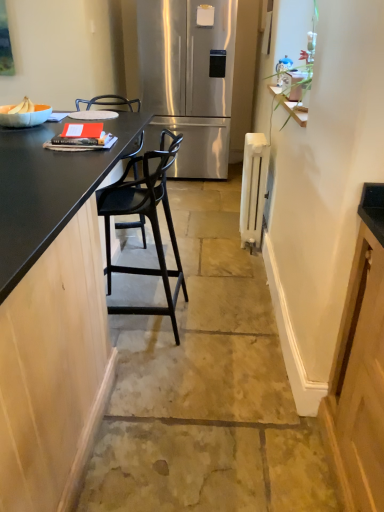
This screenshot has width=384, height=512. Describe the element at coordinates (184, 78) in the screenshot. I see `stainless steel refrigerator at center` at that location.

Locate an element on the screen. The width and height of the screenshot is (384, 512). black matte bar stool at center is located at coordinates (149, 220).

From a real-world perspective, is black matte bar stool at center positioned over stainless steel refrigerator at center based on gravity?

No, from a real-world perspective, black matte bar stool at center is not on top of stainless steel refrigerator at center.

Identify the location of refrigerator that appears above the black matte bar stool at center (from a real-world perspective). The image size is (384, 512). (184, 78).

From the image's perspective, between black matte bar stool at center and stainless steel refrigerator at center, which one is located above?

From the image's view, stainless steel refrigerator at center is above.

Which object is further away from the camera taking this photo, black matte bar stool at center or stainless steel refrigerator at center?

→ stainless steel refrigerator at center.

Is white painted metal radiator at right facing away from black matte bar stool at center?

white painted metal radiator at right does not have its back to black matte bar stool at center.

From the image's perspective, is white painted metal radiator at right positioned above or below black matte bar stool at center?

white painted metal radiator at right is above black matte bar stool at center.

Between white painted metal radiator at right and black matte bar stool at center, which one has larger width?

With larger width is black matte bar stool at center.

Which is less distant, (246,162) or (129,309)?

Point (246,162).

Between white painted metal radiator at right and black matte countertop at left, which one has smaller size?

white painted metal radiator at right.

From the image's perspective, is white painted metal radiator at right on black matte countertop at left?

Yes, from the image's perspective, white painted metal radiator at right is on top of black matte countertop at left.

Is white painted metal radiator at right further to camera compared to black matte countertop at left?

Yes.

Is white painted metal radiator at right thinner than black matte countertop at left?

Yes, white painted metal radiator at right is thinner than black matte countertop at left.

Locate an element on the screen. The image size is (384, 512). concrete in front of the stainless steel refrigerator at center is located at coordinates (207, 388).

From their relative heights in the image, would you say matte black barstool at center is taller or shorter than stainless steel refrigerator at center?

Considering their sizes, matte black barstool at center has less height than stainless steel refrigerator at center.

Which is closer to the camera, (x=114, y=444) or (x=191, y=93)?

Point (x=114, y=444) appears to be closer to the viewer than point (x=191, y=93).

Is matte black barstool at center beside stainless steel refrigerator at center?

They are not placed beside each other.

Is the surface of black matte countertop at left in direct contact with white painted metal radiator at right?

No, black matte countertop at left is not with white painted metal radiator at right.

From a real-world perspective, which is physically above, black matte countertop at left or white painted metal radiator at right?

In real-world perspective, black matte countertop at left is above.

Is point (25, 152) less distant than point (246, 240)?

Yes, it is.

Does black matte countertop at left have a greater width compared to white painted metal radiator at right?

Yes, black matte countertop at left is wider than white painted metal radiator at right.

Can you confirm if matte black barstool at center is bigger than black matte bar stool at center?

Yes.

Can you tell me how much matte black barstool at center and black matte bar stool at center differ in facing direction?

The angle between the facing direction of matte black barstool at center and the facing direction of black matte bar stool at center is 2.34 degrees.

From a real-world perspective, who is located lower, matte black barstool at center or black matte bar stool at center?

matte black barstool at center, from a real-world perspective.

In order to click on concrete that appears below the black matte bar stool at center (from a real-world perspective) in this screenshot , I will do `click(207, 388)`.

Is point (158, 74) in front of point (142, 197)?

That is False.

From the image's perspective, relative to black matte bar stool at center, is stainless steel refrigerator at center above or below?

From the image's perspective, stainless steel refrigerator at center appears above black matte bar stool at center.

Considering the sizes of objects stainless steel refrigerator at center and black matte bar stool at center in the image provided, who is smaller, stainless steel refrigerator at center or black matte bar stool at center?

black matte bar stool at center is smaller.

Consider the image. Does stainless steel refrigerator at center have a greater height compared to black matte bar stool at center?

Correct, stainless steel refrigerator at center is much taller as black matte bar stool at center.

This screenshot has height=512, width=384. I want to click on chair that appears below the stainless steel refrigerator at center (from a real-world perspective), so click(x=149, y=220).

Find the location of a particular element. appliance on the right of the black matte bar stool at center is located at coordinates (253, 188).

Estimate the real-world distances between objects in this image. Which object is further from matte black barstool at center, white painted metal radiator at right or stainless steel refrigerator at center?

stainless steel refrigerator at center is positioned further to the anchor matte black barstool at center.

When comparing their distances from black matte countertop at left, does white painted metal radiator at right or black matte bar stool at center seem closer?

black matte bar stool at center is positioned closer to the anchor black matte countertop at left.

Which object lies further to the anchor point stainless steel refrigerator at center, matte black barstool at center or black matte bar stool at center?

matte black barstool at center lies further to stainless steel refrigerator at center than the other object.

When comparing their distances from white painted metal radiator at right, does stainless steel refrigerator at center or black matte bar stool at center seem further?

stainless steel refrigerator at center is further to white painted metal radiator at right.

When comparing their distances from stainless steel refrigerator at center, does black matte countertop at left or black matte bar stool at center seem closer?

black matte countertop at left lies closer to stainless steel refrigerator at center than the other object.

Based on their spatial positions, is white painted metal radiator at right or matte black barstool at center further from stainless steel refrigerator at center?

Based on the image, matte black barstool at center appears to be further to stainless steel refrigerator at center.

Which object lies nearer to the anchor point stainless steel refrigerator at center, black matte bar stool at center or matte black barstool at center?

black matte bar stool at center is closer to stainless steel refrigerator at center.

From the image, which object appears to be farther from stainless steel refrigerator at center, white painted metal radiator at right or black matte countertop at left?

black matte countertop at left.

Identify the location of countertop located between black matte bar stool at center and stainless steel refrigerator at center in the depth direction. (47, 189).

The width and height of the screenshot is (384, 512). Find the location of `appliance located between matte black barstool at center and stainless steel refrigerator at center in the depth direction`. appliance located between matte black barstool at center and stainless steel refrigerator at center in the depth direction is located at coordinates (253, 188).

Locate an element on the screen. This screenshot has height=512, width=384. chair between matte black barstool at center and stainless steel refrigerator at center along the z-axis is located at coordinates (149, 220).

I want to click on chair between black matte countertop at left and white painted metal radiator at right from left to right, so click(149, 220).